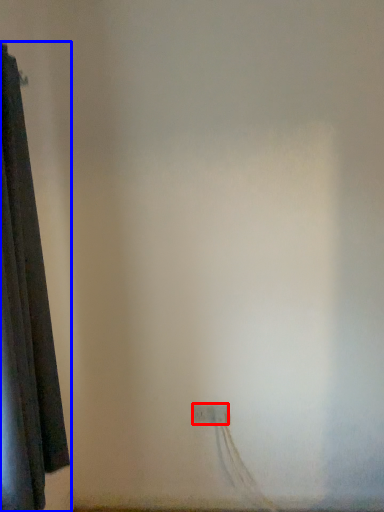
Question: Which object appears closest to the camera in this image, power plugs and sockets (highlighted by a red box) or curtain (highlighted by a blue box)?

Choices:
 (A) power plugs and sockets
 (B) curtain

Answer: (B)